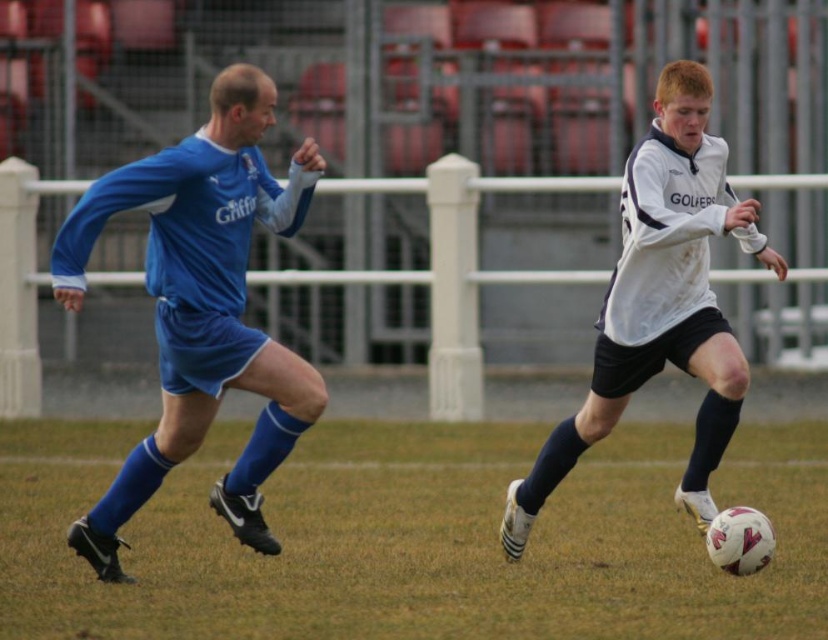
You are a soccer coach observing the game. You notice the green grass at center and the matte blue jersey at left. How far apart are these two elements in feet?

The green grass at center and the matte blue jersey at left are 14.17 feet apart from each other.

You are a soccer player standing at point (711, 90) and need to pass the ball to your teammate at point (319, 497). Considering the positions of the two players in blue and white jerseys, which direction should you pass the ball to avoid the opposing player in blue?

You should pass the ball behind the opposing player in blue jersey since point (319, 497) is behind point (711, 90), meaning the pass direction is away from the blue player.

From the picture: You are a soccer referee observing the match. You need to determine if the player in the matte blue jersey at left has a clear path to the ball compared to the player in the white matte soccer ball at center. Based on their positions, which player is closer to the ball?

The matte blue jersey at left is positioned on the left side of the white matte soccer ball at center, so the player in the blue jersey is closer to the ball than the player in the white jersey.